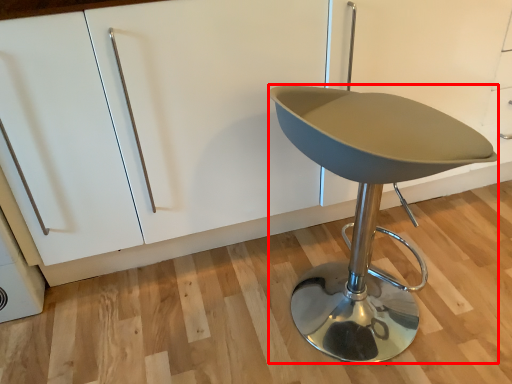
Question: In this image, where is furniture (annotated by the red box) located relative to cabinetry?

Choices:
 (A) left
 (B) right

Answer: (B)